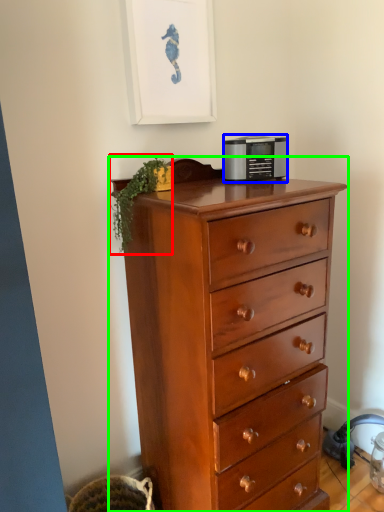
Question: Considering the real-world distances, which object is farthest from plant (highlighted by a red box)? appliance (highlighted by a blue box) or chest of drawers (highlighted by a green box)?

Choices:
 (A) appliance
 (B) chest of drawers

Answer: (B)